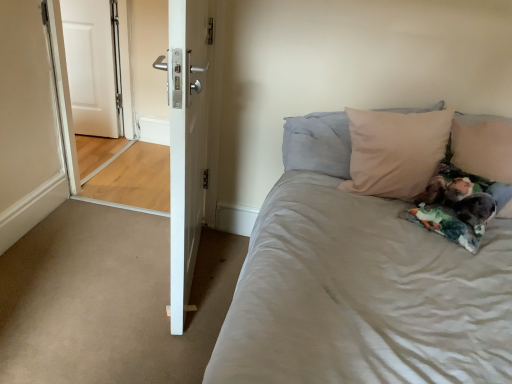
Question: Can you confirm if beige fabric pillow at upper right, the 1th pillow from the right, is shorter than white glossy door at center, the first door when ordered from right to left?

Choices:
 (A) yes
 (B) no

Answer: (A)

Question: Can you confirm if beige fabric pillow at upper right, the 1th pillow from the right, is positioned to the right of white glossy door at center, the first door when ordered from right to left?

Choices:
 (A) no
 (B) yes

Answer: (B)

Question: Considering the relative sizes of beige fabric pillow at upper right, the second pillow when ordered from left to right, and white glossy door at center, positioned as the 1th door in front-to-back order, in the image provided, is beige fabric pillow at upper right, the second pillow when ordered from left to right, wider than white glossy door at center, positioned as the 1th door in front-to-back order,?

Choices:
 (A) yes
 (B) no

Answer: (A)

Question: Is beige fabric pillow at upper right, the 1th pillow from the right, not near white glossy door at center, the first door when ordered from right to left?

Choices:
 (A) no
 (B) yes

Answer: (B)

Question: Is beige fabric pillow at upper right, the 1th pillow from the right, to the left of white glossy door at center, positioned as the 1th door in front-to-back order, from the viewer's perspective?

Choices:
 (A) yes
 (B) no

Answer: (B)

Question: Considering the positions of beige fabric pillow at upper right, which is the 1th pillow in left-to-right order, and white matte door at left, marked as the first door in a left-to-right arrangement, in the image, is beige fabric pillow at upper right, which is the 1th pillow in left-to-right order, taller or shorter than white matte door at left, marked as the first door in a left-to-right arrangement,?

Choices:
 (A) tall
 (B) short

Answer: (B)

Question: In terms of width, does beige fabric pillow at upper right, which is the 1th pillow in left-to-right order, look wider or thinner when compared to white matte door at left, which ranks as the 1th door in back-to-front order?

Choices:
 (A) wide
 (B) thin

Answer: (A)

Question: Considering their positions, is beige fabric pillow at upper right, placed as the second pillow when sorted from right to left, located in front of or behind white matte door at left, the second door when ordered from front to back?

Choices:
 (A) behind
 (B) front

Answer: (B)

Question: From the image's perspective, is beige fabric pillow at upper right, placed as the second pillow when sorted from right to left, located above or below white matte door at left, which ranks as the 1th door in back-to-front order?

Choices:
 (A) below
 (B) above

Answer: (A)

Question: Looking at their shapes, would you say beige fabric pillow at upper right, the 1th pillow from the right, is wider or thinner than white glossy door at left?

Choices:
 (A) thin
 (B) wide

Answer: (B)

Question: Considering the relative positions of beige fabric pillow at upper right, the second pillow when ordered from left to right, and white glossy door at left in the image provided, is beige fabric pillow at upper right, the second pillow when ordered from left to right, to the left or to the right of white glossy door at left?

Choices:
 (A) right
 (B) left

Answer: (A)

Question: From the image's perspective, is beige fabric pillow at upper right, the 1th pillow from the right, positioned above or below white glossy door at left?

Choices:
 (A) above
 (B) below

Answer: (B)

Question: From their relative heights in the image, would you say beige fabric pillow at upper right, the 1th pillow from the right, is taller or shorter than white glossy door at left?

Choices:
 (A) short
 (B) tall

Answer: (A)

Question: Is white glossy door at center, the 2th door from the left, taller or shorter than white matte door at left, marked as the first door in a left-to-right arrangement?

Choices:
 (A) tall
 (B) short

Answer: (A)

Question: Is white glossy door at center, the 2th door from the left, bigger or smaller than white matte door at left, the 2th door in the right-to-left sequence?

Choices:
 (A) small
 (B) big

Answer: (B)